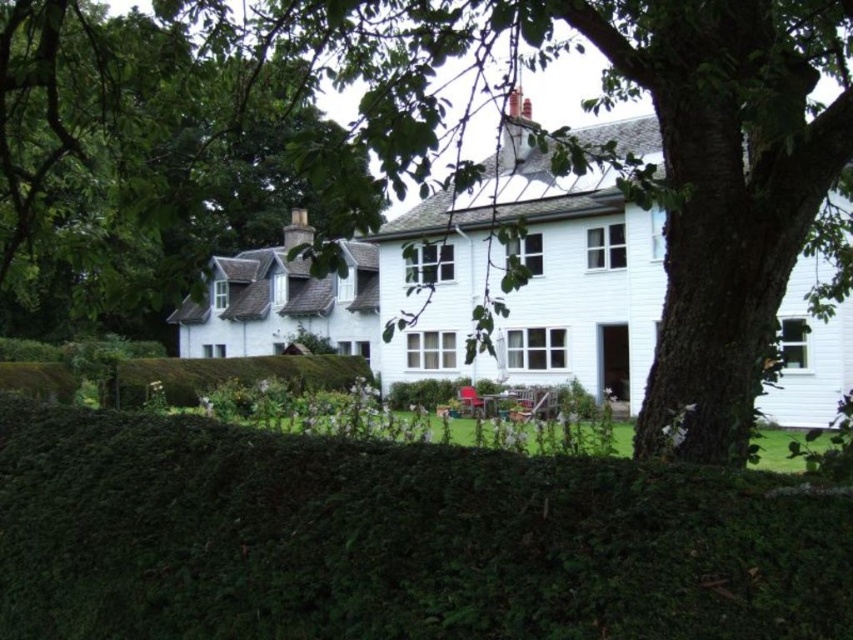
Between green leafy tree at center and green leafy tree at upper left, which one has less height?

With less height is green leafy tree at center.

In the scene shown: Between green leafy tree at center and green leafy tree at upper left, which one is positioned lower?

green leafy tree at center is lower down.

Which is behind, point (448, 131) or point (242, 116)?

Positioned behind is point (242, 116).

Where is `green leafy tree at center`? The width and height of the screenshot is (853, 640). green leafy tree at center is located at coordinates click(631, 156).

Is green leafy hedge at lower center positioned before green leafy tree at upper left?

Yes, green leafy hedge at lower center is closer to the viewer.

Which of these two, green leafy hedge at lower center or green leafy tree at upper left, stands taller?

green leafy tree at upper left is taller.

Where is `green leafy hedge at lower center`? green leafy hedge at lower center is located at coordinates (392, 540).

Where is `green leafy hedge at lower center`? This screenshot has height=640, width=853. green leafy hedge at lower center is located at coordinates (392, 540).

Which of these two, green leafy hedge at lower center or green leafy tree at center, stands taller?

Standing taller between the two is green leafy tree at center.

Does green leafy hedge at lower center appear on the left side of green leafy tree at center?

Yes, green leafy hedge at lower center is to the left of green leafy tree at center.

Is point (752, 616) positioned behind point (682, 120)?

No, it is in front of (682, 120).

The width and height of the screenshot is (853, 640). In order to click on green leafy hedge at lower center in this screenshot , I will do `click(392, 540)`.